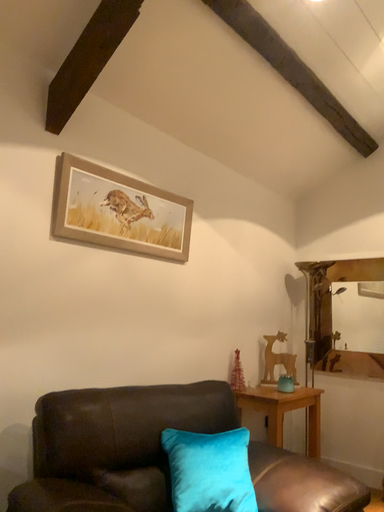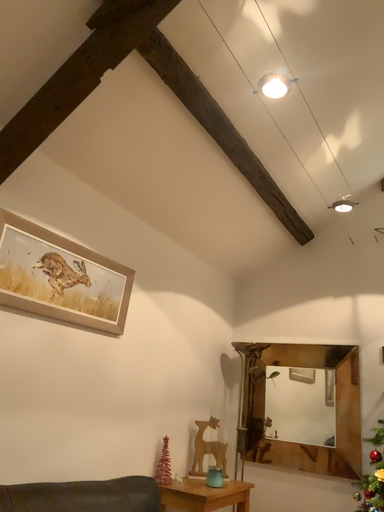
Question: Which way did the camera rotate in the video?

Choices:
 (A) rotated downward
 (B) rotated upward

Answer: (B)